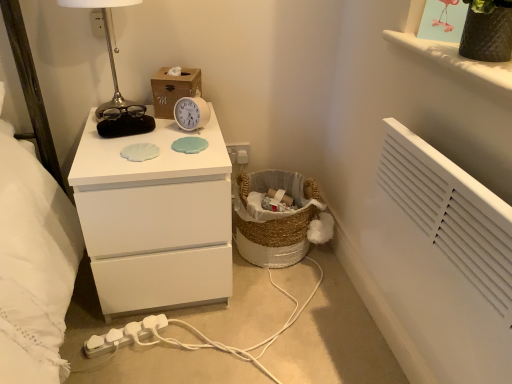
Question: Could you tell me if white plastic extension cord at lower left is turned towards white plastic electric outlet at upper center?

Choices:
 (A) no
 (B) yes

Answer: (A)

Question: Can you confirm if white plastic extension cord at lower left is shorter than white plastic electric outlet at upper center?

Choices:
 (A) yes
 (B) no

Answer: (A)

Question: Is white plastic extension cord at lower left outside white plastic electric outlet at upper center?

Choices:
 (A) yes
 (B) no

Answer: (A)

Question: From the image's perspective, does white plastic extension cord at lower left appear lower than white plastic electric outlet at upper center?

Choices:
 (A) no
 (B) yes

Answer: (B)

Question: Can you confirm if white plastic extension cord at lower left is wider than white plastic electric outlet at upper center?

Choices:
 (A) no
 (B) yes

Answer: (B)

Question: Considering the relative positions of white plastic extension cord at lower left and white plastic electric outlet at upper center in the image provided, is white plastic extension cord at lower left behind white plastic electric outlet at upper center?

Choices:
 (A) no
 (B) yes

Answer: (A)

Question: From the image's perspective, is white plastic alarm clock at center under woven natural basket at lower center?

Choices:
 (A) yes
 (B) no

Answer: (B)

Question: From the image's perspective, would you say white plastic alarm clock at center is positioned over woven natural basket at lower center?

Choices:
 (A) no
 (B) yes

Answer: (B)

Question: From a real-world perspective, is white plastic alarm clock at center beneath woven natural basket at lower center?

Choices:
 (A) yes
 (B) no

Answer: (B)

Question: Is woven natural basket at lower center surrounded by white plastic alarm clock at center?

Choices:
 (A) no
 (B) yes

Answer: (A)

Question: Is white plastic alarm clock at center wider than woven natural basket at lower center?

Choices:
 (A) no
 (B) yes

Answer: (A)

Question: Is white plastic alarm clock at center positioned behind woven natural basket at lower center?

Choices:
 (A) yes
 (B) no

Answer: (B)

Question: From a real-world perspective, is textured brown vase at upper right located higher than white matte chest of drawers at center?

Choices:
 (A) yes
 (B) no

Answer: (A)